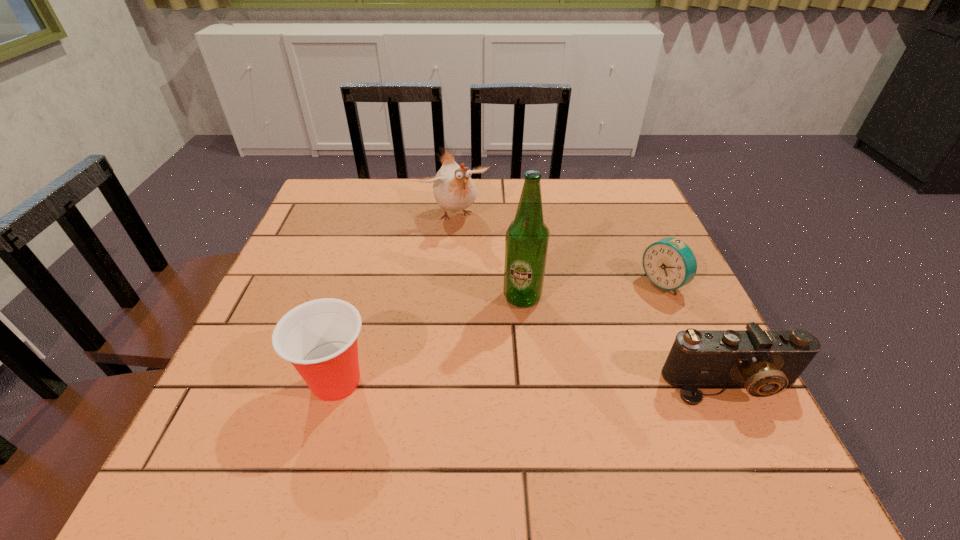
Where is `vacant space located 0.120m at the beak of the farthest object`? This screenshot has height=540, width=960. vacant space located 0.120m at the beak of the farthest object is located at coordinates (487, 259).

Identify the location of free space located at the beak of the farthest object. (513, 300).

The width and height of the screenshot is (960, 540). What are the coordinates of `vacant space located on the front-facing side of the alarm clock` in the screenshot? It's located at (546, 356).

Identify the location of free point located on the front-facing side of the alarm clock. The height and width of the screenshot is (540, 960). (621, 310).

Image resolution: width=960 pixels, height=540 pixels. Identify the location of vacant space located on the front-facing side of the alarm clock. (612, 316).

Image resolution: width=960 pixels, height=540 pixels. In order to click on free space located 0.130m on the label of the beer bottle in this screenshot , I will do tap(555, 357).

The width and height of the screenshot is (960, 540). Find the location of `vacant region located 0.140m on the label of the beer bottle`. vacant region located 0.140m on the label of the beer bottle is located at coordinates (558, 361).

The image size is (960, 540). I want to click on free spot located on the label of the beer bottle, so click(x=551, y=349).

In order to click on object that is at the far edge in this screenshot , I will do `click(454, 190)`.

Locate an element on the screen. The image size is (960, 540). cup that is at the near edge is located at coordinates (319, 337).